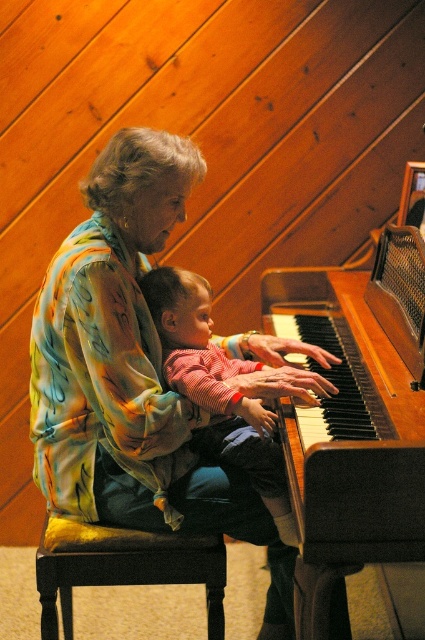
Which of these two, wooden piano at center or striped cotton shirt at center, stands taller?

Standing taller between the two is wooden piano at center.

Describe the element at coordinates (354, 416) in the screenshot. I see `wooden piano at center` at that location.

What are the coordinates of `wooden piano at center` in the screenshot? It's located at (354, 416).

What do you see at coordinates (132, 372) in the screenshot? I see `multicolored silk blouse at upper left` at bounding box center [132, 372].

Can you confirm if multicolored silk blouse at upper left is positioned to the left of velvet cushioned stool at lower left?

No, multicolored silk blouse at upper left is not to the left of velvet cushioned stool at lower left.

Find the location of a particular element. The height and width of the screenshot is (640, 425). multicolored silk blouse at upper left is located at coordinates (132, 372).

Find the location of `multicolored silk blouse at upper left`. multicolored silk blouse at upper left is located at coordinates (132, 372).

In the scene shown: Is multicolored silk blouse at upper left thinner than wooden piano at center?

Incorrect, multicolored silk blouse at upper left's width is not less than wooden piano at center's.

Between multicolored silk blouse at upper left and wooden piano at center, which one is positioned lower?

Positioned lower is multicolored silk blouse at upper left.

This screenshot has height=640, width=425. I want to click on multicolored silk blouse at upper left, so click(132, 372).

The image size is (425, 640). What are the coordinates of `multicolored silk blouse at upper left` in the screenshot? It's located at (132, 372).